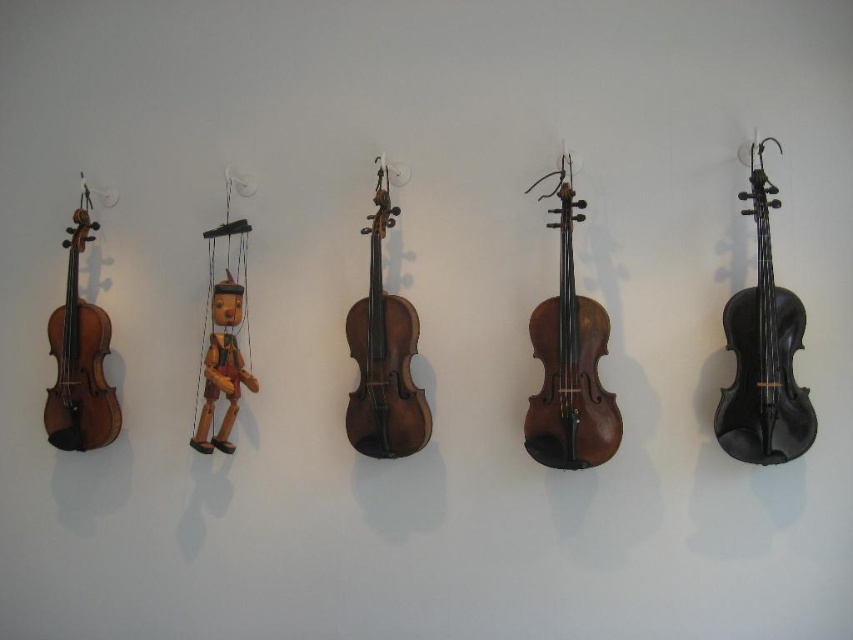
Is point (560, 444) positioned behind point (74, 420)?

No, it is not.

Measure the distance between dark brown wood cello at center and camera.

dark brown wood cello at center is 2.12 meters away from camera.

Does point (572, 276) lie behind point (77, 280)?

That is False.

Where is `dark brown wood cello at center`? dark brown wood cello at center is located at coordinates (569, 358).

Can you confirm if black matte cello at right is positioned below wooden violin at center?

No, black matte cello at right is not below wooden violin at center.

Is black matte cello at right shorter than wooden violin at center?

Correct, black matte cello at right is not as tall as wooden violin at center.

Which is in front, point (780, 460) or point (384, 371)?

Point (780, 460)

The height and width of the screenshot is (640, 853). I want to click on black matte cello at right, so click(763, 349).

What do you see at coordinates (763, 349) in the screenshot? I see `black matte cello at right` at bounding box center [763, 349].

Is black matte cello at right closer to camera compared to matte brown violin at left?

Yes, it is in front of matte brown violin at left.

Describe the element at coordinates (763, 349) in the screenshot. I see `black matte cello at right` at that location.

Locate an element on the screen. black matte cello at right is located at coordinates (763, 349).